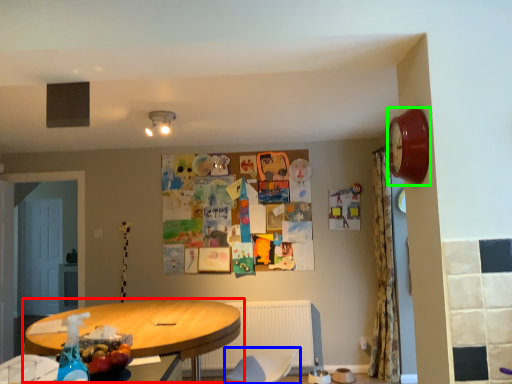
Question: Which object is the closest to the table (highlighted by a red box)? Choose among these: swivel chair (highlighted by a blue box) or clock (highlighted by a green box).

Choices:
 (A) swivel chair
 (B) clock

Answer: (A)